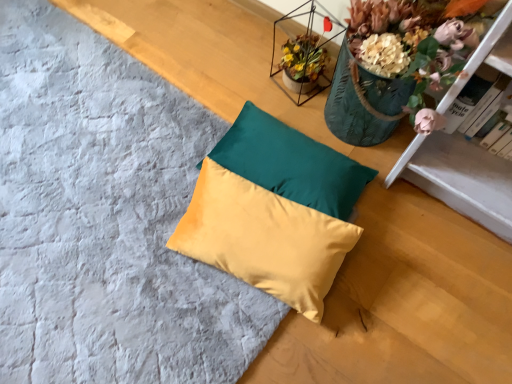
This screenshot has width=512, height=384. What do you see at coordinates (291, 163) in the screenshot?
I see `satin yellow pillow at center, marked as the second pillow in a bottom-to-top arrangement` at bounding box center [291, 163].

This screenshot has width=512, height=384. What do you see at coordinates (475, 106) in the screenshot? I see `hardcover book at upper right` at bounding box center [475, 106].

Locate an element on the screen. satin yellow pillow at center, placed as the first pillow when sorted from top to bottom is located at coordinates (291, 163).

Is satin yellow pillow at center, marked as the second pillow in a bottom-to-top arrangement, completely or partially outside of hardcover book at upper right?

Yes, satin yellow pillow at center, marked as the second pillow in a bottom-to-top arrangement, is not within hardcover book at upper right.

Looking at this image, is satin yellow pillow at center, placed as the first pillow when sorted from top to bottom, touching hardcover book at upper right?

They are not placed beside each other.

Which point is more forward, (288, 170) or (459, 113)?

Positioned in front is point (459, 113).

From the image's perspective, is satin yellow pillow at center, placed as the first pillow when sorted from top to bottom, under hardcover book at upper right?

Yes, from the image's perspective, satin yellow pillow at center, placed as the first pillow when sorted from top to bottom, is below hardcover book at upper right.

Is hardcover book at upper right aimed at satin yellow pillow at center, which is the 2th pillow in top-to-bottom order?

No, hardcover book at upper right is not aimed at satin yellow pillow at center, which is the 2th pillow in top-to-bottom order.

Is hardcover book at upper right shorter than satin yellow pillow at center, which is the 2th pillow in top-to-bottom order?

Incorrect, the height of hardcover book at upper right does not fall short of that of satin yellow pillow at center, which is the 2th pillow in top-to-bottom order.

Is hardcover book at upper right with satin yellow pillow at center, acting as the first pillow starting from the bottom?

No, hardcover book at upper right is not touching satin yellow pillow at center, acting as the first pillow starting from the bottom.

Does point (493, 113) come in front of point (257, 114)?

Yes, point (493, 113) is in front of point (257, 114).

Is satin yellow pillow at center, acting as the first pillow starting from the bottom, beside satin yellow pillow at center, marked as the second pillow in a bottom-to-top arrangement?

Yes, satin yellow pillow at center, acting as the first pillow starting from the bottom, is right next to satin yellow pillow at center, marked as the second pillow in a bottom-to-top arrangement, and making contact.

In the scene shown: Does satin yellow pillow at center, which is the 2th pillow in top-to-bottom order, have a larger size compared to satin yellow pillow at center, placed as the first pillow when sorted from top to bottom?

Yes, satin yellow pillow at center, which is the 2th pillow in top-to-bottom order, is bigger than satin yellow pillow at center, placed as the first pillow when sorted from top to bottom.

Does satin yellow pillow at center, acting as the first pillow starting from the bottom, turn towards satin yellow pillow at center, placed as the first pillow when sorted from top to bottom?

No, satin yellow pillow at center, acting as the first pillow starting from the bottom, is not aimed at satin yellow pillow at center, placed as the first pillow when sorted from top to bottom.

From the image's perspective, is satin yellow pillow at center, acting as the first pillow starting from the bottom, on top of satin yellow pillow at center, marked as the second pillow in a bottom-to-top arrangement?

Incorrect, from the image's perspective, satin yellow pillow at center, acting as the first pillow starting from the bottom, is lower than satin yellow pillow at center, marked as the second pillow in a bottom-to-top arrangement.

Would you say satin yellow pillow at center, acting as the first pillow starting from the bottom, is part of satin yellow pillow at center, placed as the first pillow when sorted from top to bottom,'s contents?

Definitely not — satin yellow pillow at center, acting as the first pillow starting from the bottom, is not inside satin yellow pillow at center, placed as the first pillow when sorted from top to bottom.

Looking at this image, based on their sizes in the image, would you say satin yellow pillow at center, placed as the first pillow when sorted from top to bottom, is bigger or smaller than satin yellow pillow at center, acting as the first pillow starting from the bottom?

In the image, satin yellow pillow at center, placed as the first pillow when sorted from top to bottom, appears to be smaller than satin yellow pillow at center, acting as the first pillow starting from the bottom.

Image resolution: width=512 pixels, height=384 pixels. In order to click on pillow above the satin yellow pillow at center, acting as the first pillow starting from the bottom (from the image's perspective) in this screenshot , I will do `click(291, 163)`.

In terms of size, does satin yellow pillow at center, which is the 2th pillow in top-to-bottom order, appear bigger or smaller than hardcover book at upper right?

satin yellow pillow at center, which is the 2th pillow in top-to-bottom order, is bigger than hardcover book at upper right.

Looking at their sizes, would you say satin yellow pillow at center, which is the 2th pillow in top-to-bottom order, is wider or thinner than hardcover book at upper right?

satin yellow pillow at center, which is the 2th pillow in top-to-bottom order, is wider than hardcover book at upper right.

From the picture: Which object is more forward, satin yellow pillow at center, acting as the first pillow starting from the bottom, or hardcover book at upper right?

hardcover book at upper right is more forward.

From the image's perspective, would you say satin yellow pillow at center, which is the 2th pillow in top-to-bottom order, is shown under hardcover book at upper right?

Correct, satin yellow pillow at center, which is the 2th pillow in top-to-bottom order, appears lower than hardcover book at upper right in the image.

Can you tell me how much hardcover book at upper right and satin yellow pillow at center, marked as the second pillow in a bottom-to-top arrangement, differ in facing direction?

They differ by 2.29 degrees in their facing directions.

Locate an element on the screen. The height and width of the screenshot is (384, 512). the 2nd pillow behind the hardcover book at upper right is located at coordinates (291, 163).

Considering the sizes of objects hardcover book at upper right and satin yellow pillow at center, marked as the second pillow in a bottom-to-top arrangement, in the image provided, who is smaller, hardcover book at upper right or satin yellow pillow at center, marked as the second pillow in a bottom-to-top arrangement,?

hardcover book at upper right.

From a real-world perspective, between hardcover book at upper right and satin yellow pillow at center, placed as the first pillow when sorted from top to bottom, who is vertically lower?

satin yellow pillow at center, placed as the first pillow when sorted from top to bottom.

Locate an element on the screen. Image resolution: width=512 pixels, height=384 pixels. the 1st pillow below the hardcover book at upper right (from the image's perspective) is located at coordinates (291, 163).

There is a hardcover book at upper right. Identify the location of the 1st pillow below it (from a real-world perspective). (274, 210).

From the image, which object appears to be farther from satin yellow pillow at center, placed as the first pillow when sorted from top to bottom, satin yellow pillow at center, which is the 2th pillow in top-to-bottom order, or hardcover book at upper right?

hardcover book at upper right lies further to satin yellow pillow at center, placed as the first pillow when sorted from top to bottom, than the other object.

Estimate the real-world distances between objects in this image. Which object is further from satin yellow pillow at center, acting as the first pillow starting from the bottom, satin yellow pillow at center, marked as the second pillow in a bottom-to-top arrangement, or hardcover book at upper right?

Among the two, hardcover book at upper right is located further to satin yellow pillow at center, acting as the first pillow starting from the bottom.

Considering their positions, is satin yellow pillow at center, placed as the first pillow when sorted from top to bottom, positioned closer to hardcover book at upper right than satin yellow pillow at center, which is the 2th pillow in top-to-bottom order?

The object closer to hardcover book at upper right is satin yellow pillow at center, placed as the first pillow when sorted from top to bottom.

From the picture: From the image, which object appears to be nearer to satin yellow pillow at center, acting as the first pillow starting from the bottom, hardcover book at upper right or satin yellow pillow at center, placed as the first pillow when sorted from top to bottom?

satin yellow pillow at center, placed as the first pillow when sorted from top to bottom.

Considering their positions, is hardcover book at upper right positioned further to satin yellow pillow at center, marked as the second pillow in a bottom-to-top arrangement, than satin yellow pillow at center, acting as the first pillow starting from the bottom?

Based on the image, hardcover book at upper right appears to be further to satin yellow pillow at center, marked as the second pillow in a bottom-to-top arrangement.

Which object lies further to the anchor point hardcover book at upper right, satin yellow pillow at center, which is the 2th pillow in top-to-bottom order, or satin yellow pillow at center, placed as the first pillow when sorted from top to bottom?

satin yellow pillow at center, which is the 2th pillow in top-to-bottom order, lies further to hardcover book at upper right than the other object.

Find the location of a particular element. pillow situated between satin yellow pillow at center, which is the 2th pillow in top-to-bottom order, and hardcover book at upper right from left to right is located at coordinates (291, 163).